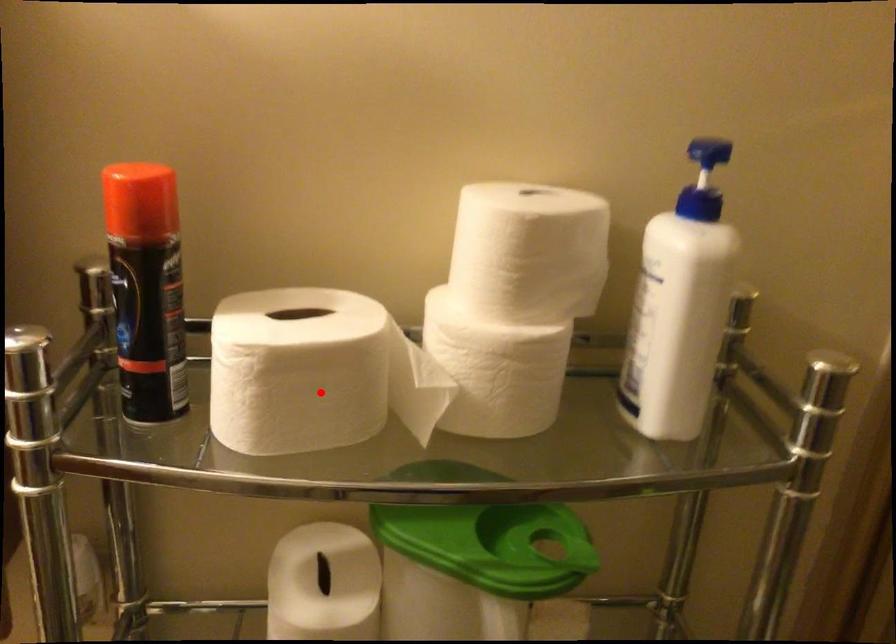
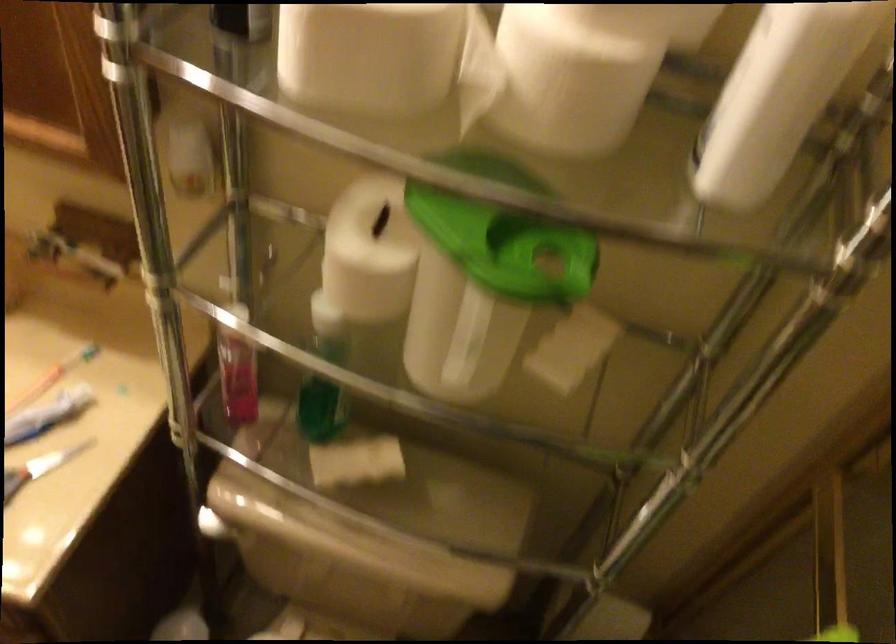
The point at the highlighted location is marked in the first image. Where is the corresponding point in the second image?

(368, 55)